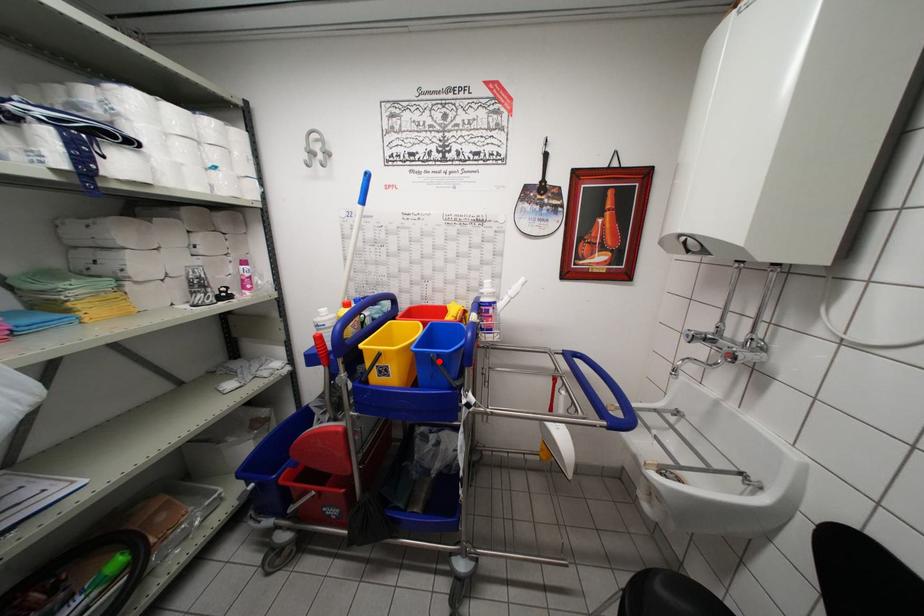
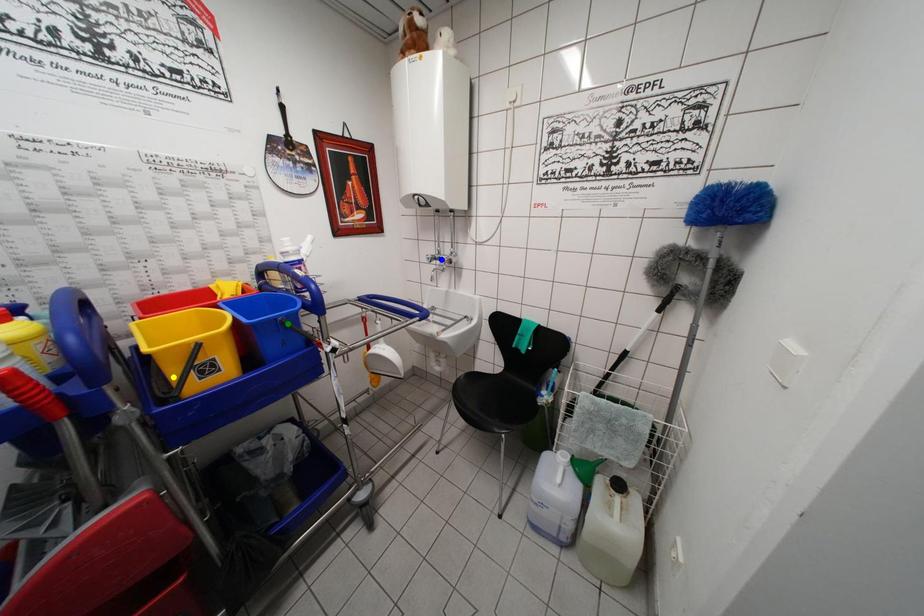
Question: I am providing you with two images of the same scene from different viewpoints. A red point is marked on the first image. You are given multiple points on the second image. Which point in image 2 represents the same 3d spot as the red point in image 1?

Choices:
 (A) blue point
 (B) yellow point
 (C) green point

Answer: (C)